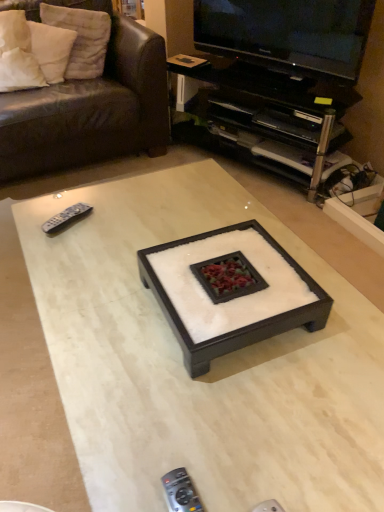
The height and width of the screenshot is (512, 384). In order to click on free space in front of gray plastic remote at left, acting as the 2th remote control starting from the front in this screenshot , I will do `click(67, 257)`.